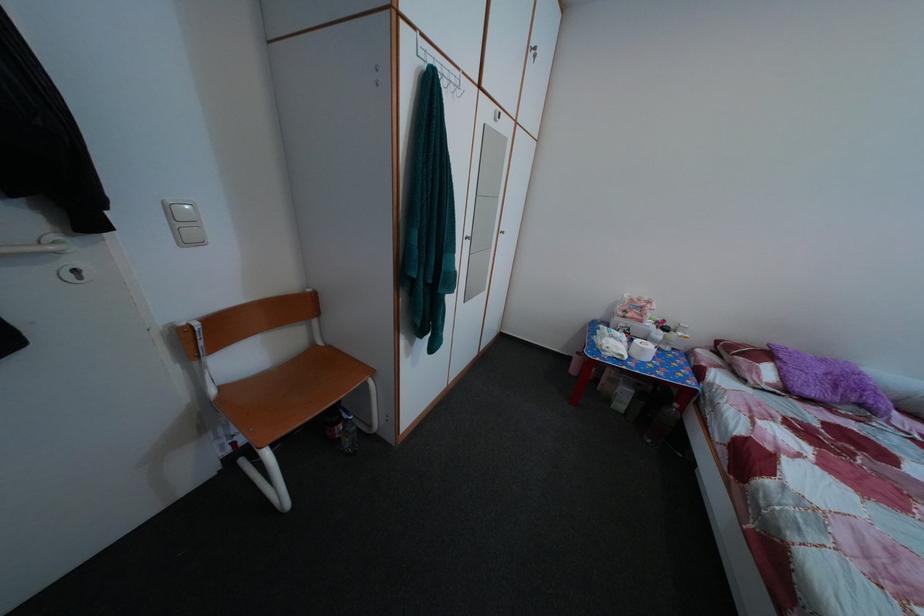
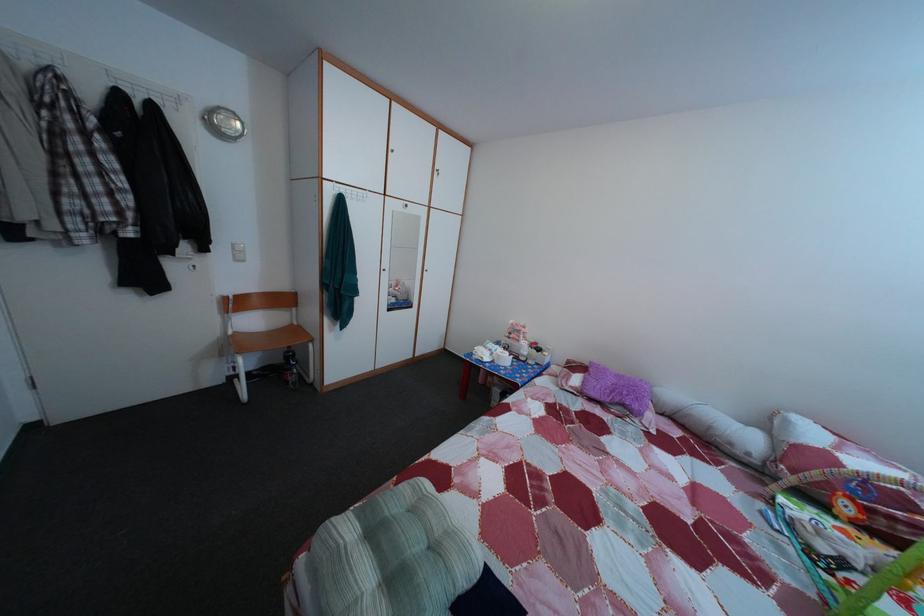
The point at [860,416] is marked in the first image. Where is the corresponding point in the second image?

(628, 416)